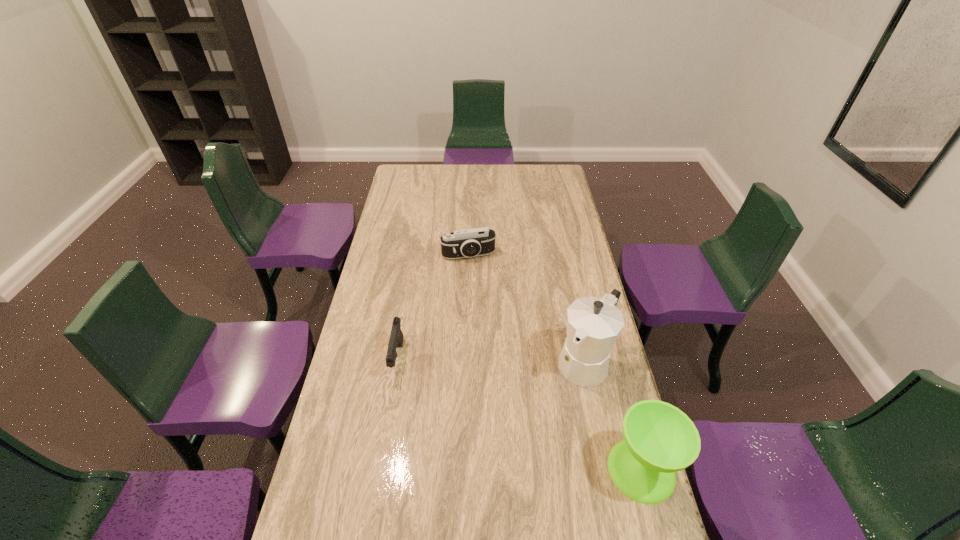
Identify the location of vacant spot on the desktop that is between the pistol and the wineglass and is positioned at the spout of the coffeepot. This screenshot has height=540, width=960. (539, 423).

Where is `free spot on the desktop that is between the pistol and the third shortest object and is positioned on the front lens of the farthest object`? The height and width of the screenshot is (540, 960). free spot on the desktop that is between the pistol and the third shortest object and is positioned on the front lens of the farthest object is located at coordinates (513, 411).